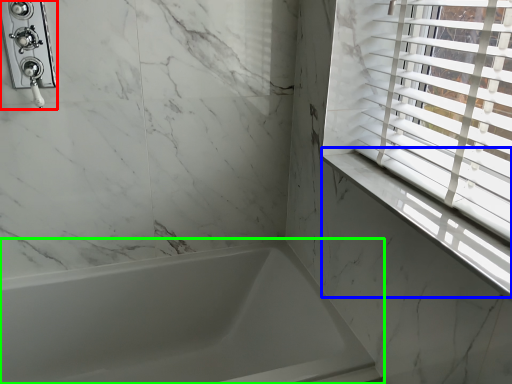
Question: Considering the real-world distances, which object is closest to shower (highlighted by a red box)? window sill (highlighted by a blue box) or bathtub (highlighted by a green box).

Choices:
 (A) window sill
 (B) bathtub

Answer: (B)